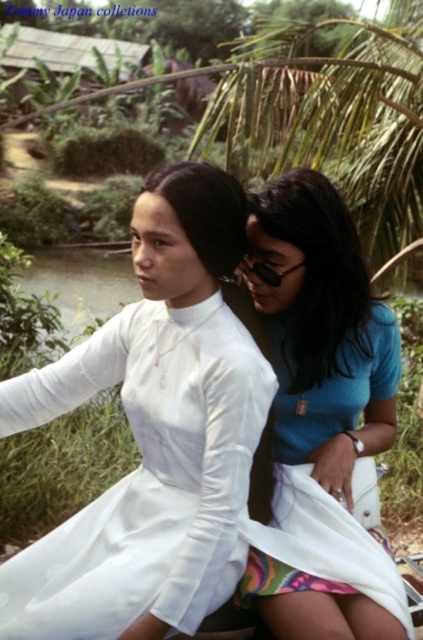
Question: Among these points, which one is farthest from the camera?

Choices:
 (A) (362, 593)
 (B) (69, 589)

Answer: (A)

Question: Is white satin dress at center wider than blue matte shirt at center?

Choices:
 (A) yes
 (B) no

Answer: (A)

Question: Which point is closer to the camera taking this photo?

Choices:
 (A) (x=283, y=259)
 (B) (x=33, y=573)

Answer: (B)

Question: Which point is farther to the camera?

Choices:
 (A) blue matte shirt at center
 (B) white satin dress at center

Answer: (A)

Question: From the image, what is the correct spatial relationship of white satin dress at center in relation to blue matte shirt at center?

Choices:
 (A) right
 (B) left

Answer: (B)

Question: Does white satin dress at center appear over blue matte shirt at center?

Choices:
 (A) yes
 (B) no

Answer: (B)